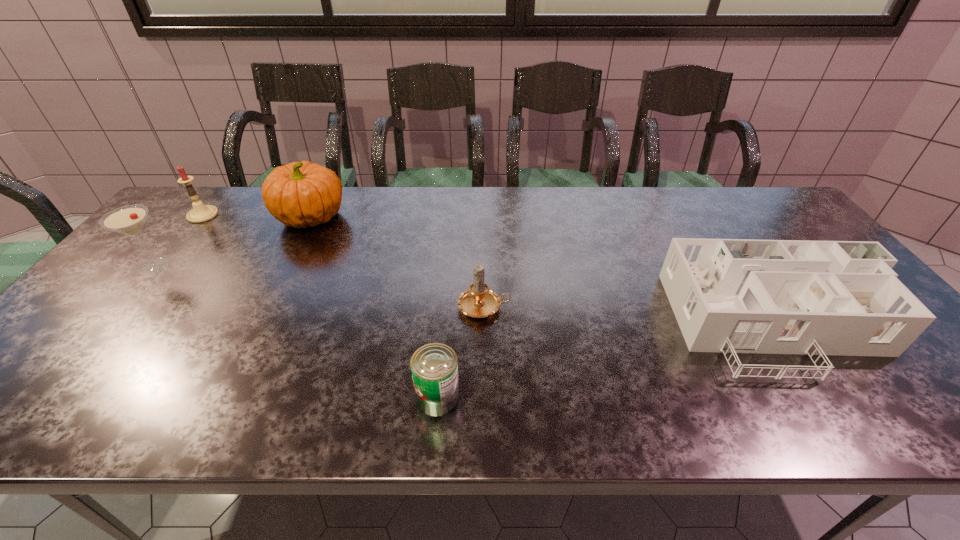
Where is `free point located on the right of the taller candle`? This screenshot has height=540, width=960. free point located on the right of the taller candle is located at coordinates (279, 215).

Identify the location of vacant area located 0.260m on the front of the right candle. (485, 419).

Identify the location of free location located 0.050m on the back of the rightmost object. (743, 264).

This screenshot has height=540, width=960. In order to click on free space located on the back of the can in this screenshot , I will do `click(442, 353)`.

Where is `pumpkin that is at the far edge`? pumpkin that is at the far edge is located at coordinates (300, 194).

At what (x,y) coordinates should I click in order to perform the action: click on candle that is at the far edge. Please return your answer as a coordinate pair (x, y). The height and width of the screenshot is (540, 960). Looking at the image, I should click on (200, 213).

Identify the location of object that is at the near edge. (434, 366).

Identify the location of martini positioned at the left edge. (128, 220).

Locate an element on the screen. This screenshot has height=540, width=960. candle present at the left edge is located at coordinates (200, 213).

Image resolution: width=960 pixels, height=540 pixels. Identify the location of object that is at the right edge. (842, 298).